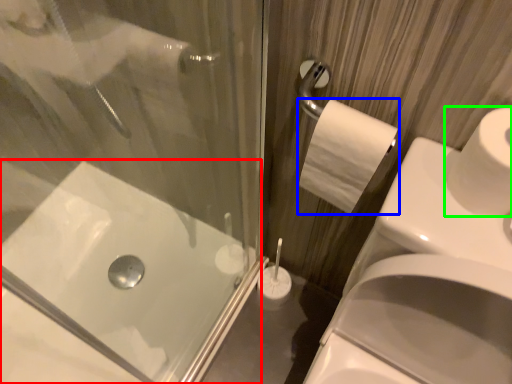
Question: Estimate the real-world distances between objects in this image. Which object is farther from bath (highlighted by a red box), toilet paper (highlighted by a blue box) or toilet paper (highlighted by a green box)?

Choices:
 (A) toilet paper
 (B) toilet paper

Answer: (B)